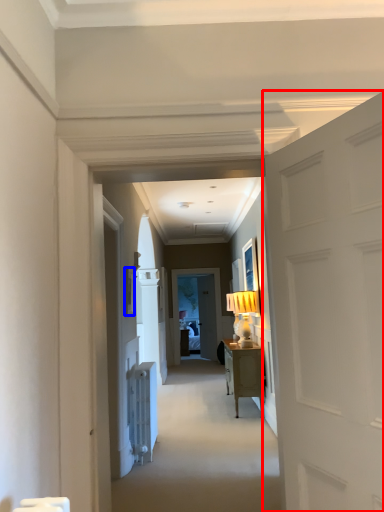
Question: Among these objects, which one is farthest to the camera, door (highlighted by a red box) or picture frame (highlighted by a blue box)?

Choices:
 (A) door
 (B) picture frame

Answer: (B)